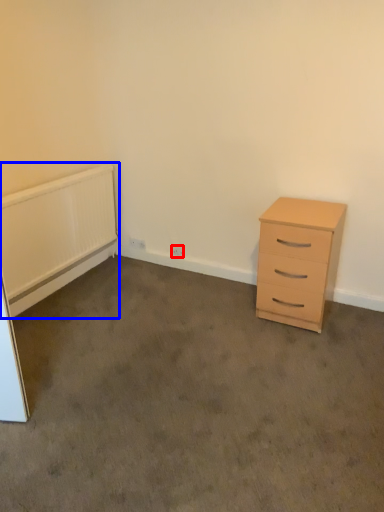
Question: Which of the following is the farthest to the observer, electric outlet (highlighted by a red box) or radiator (highlighted by a blue box)?

Choices:
 (A) electric outlet
 (B) radiator

Answer: (A)